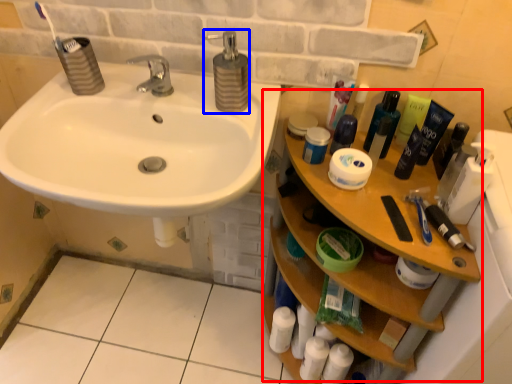
Question: Which point is further to the camera, counter (highlighted by a red box) or soap dispenser (highlighted by a blue box)?

Choices:
 (A) counter
 (B) soap dispenser

Answer: (B)